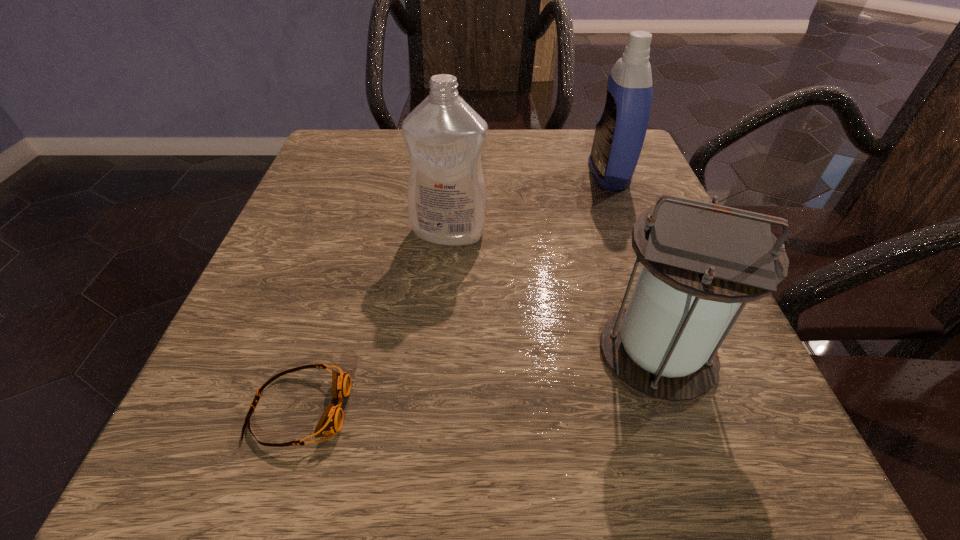
Locate an element on the screen. free space between the third object from right to left and the goggles is located at coordinates (374, 321).

At what (x,y) coordinates should I click in order to perform the action: click on vacant area that lies between the lantern and the third nearest object. Please return your answer as a coordinate pair (x, y). This screenshot has width=960, height=540. Looking at the image, I should click on (553, 293).

Image resolution: width=960 pixels, height=540 pixels. Find the location of `unoccupied position between the shortest object and the farther detergent`. unoccupied position between the shortest object and the farther detergent is located at coordinates (454, 292).

Where is `vacant space that's between the right detergent and the lantern`? vacant space that's between the right detergent and the lantern is located at coordinates (633, 264).

At what (x,y) coordinates should I click in order to perform the action: click on vacant region between the lantern and the left detergent. Please return your answer as a coordinate pair (x, y). This screenshot has height=540, width=960. Looking at the image, I should click on (553, 293).

The image size is (960, 540). Find the location of `object identified as the closest to the farthest object`. object identified as the closest to the farthest object is located at coordinates (447, 201).

You are a GUI agent. You are given a task and a screenshot of the screen. Output one action in this format:
    pyautogui.click(x=<x>, y=<y>)
    Task: Click on the object that is the third nearest to the leftmost object
    The image size is (960, 540).
    Given the screenshot: What is the action you would take?
    pyautogui.click(x=620, y=131)

In order to click on vacant region that satisfies the following two spatial constraints: 1. on the back side of the lantern; 2. on the right side of the farthest object in this screenshot , I will do `click(596, 174)`.